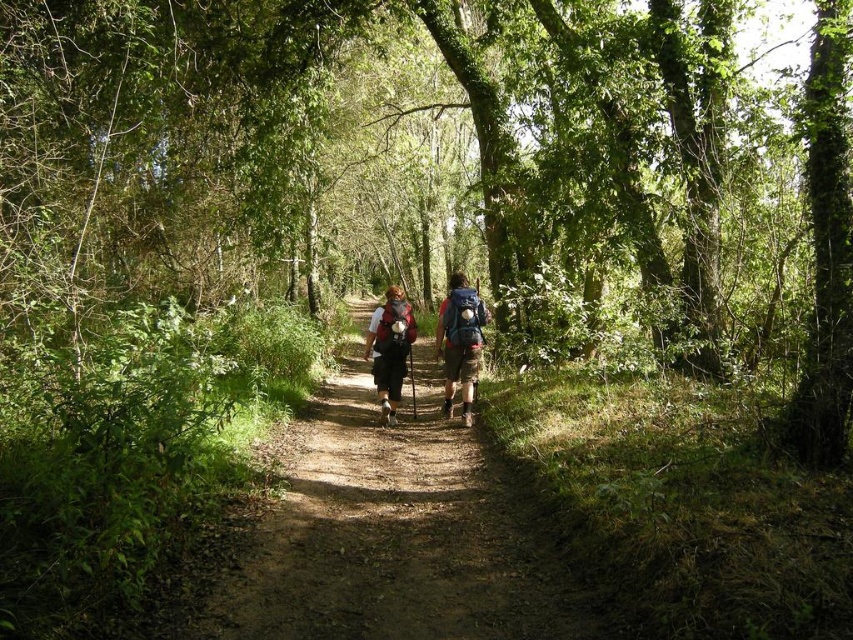
In the scene shown: You are a hiker who wants to place a 3.5 feet wide tent on the dirt path at center. The tent must be placed entirely on the path. Can you fit the tent on the path without overlapping the matte black backpack at center?

The dirt path at center and matte black backpack at center are 7.20 feet apart. Since the tent is 3.5 feet wide, there is enough space between them to place the tent entirely on the path without overlapping the backpack.

You are standing at the starting point of the forest path. You see the dirt path at center located at point (392, 536). If you want to walk straight ahead, which direction should you head towards?

You should head towards the dirt path at center located at point (392, 536), as it is the central path leading forward through the forest.

You are a hiker planning to walk along the dirt path at center. You notice the matte fabric backpacks at center are placed above you. Is there enough space between the backpacks and the ground to walk underneath them?

The dirt path at center is below matte fabric backpacks at center, which means the backpacks are positioned above the path. Since the path is at the bottom, there is sufficient space between the backpacks and the ground for you to walk underneath them safely.